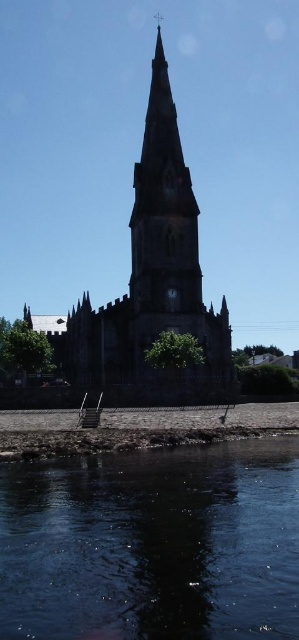
Based on the photo, you are standing on the rocky shoreline and want to cross to the other side of the smooth stone church at center. The dark blue water at lower center is in your way. Can you walk around the church instead of going through the water?

The dark blue water at lower center is wider than the smooth stone church at center, so walking around the church might be a better option since the water is wider than the church.

You are standing at the point closest to the church spire in the image. There are two points marked in the scene, one at coordinates point (x=115, y=392) and another at point (x=177, y=296). Which of these points is closer to you?

Point (x=115, y=392) is in front of point (x=177, y=296), so it is closer to you.